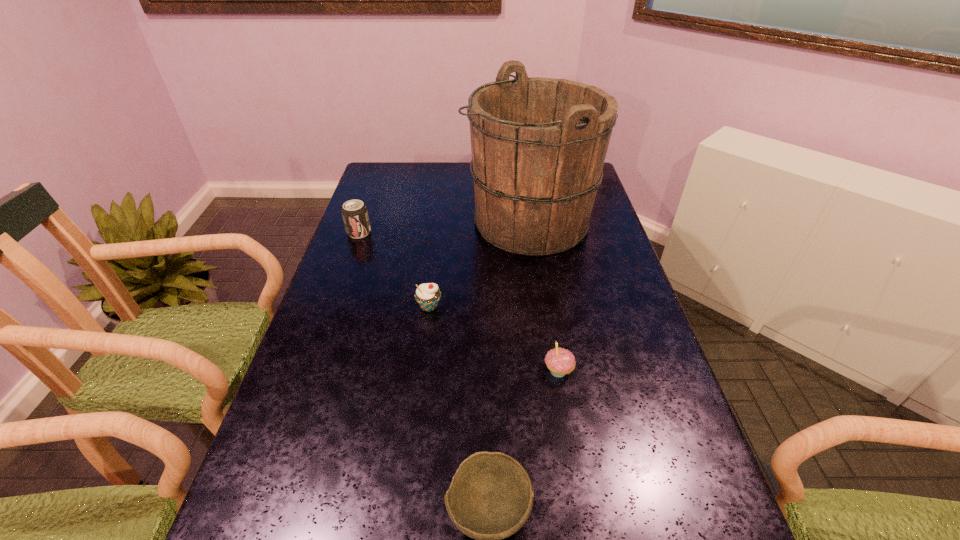
This screenshot has width=960, height=540. Identify the location of free spot between the soda can and the left cupcake. (394, 269).

At what (x,y) coordinates should I click in order to perform the action: click on vacant space that is in between the soda can and the bucket. Please return your answer as a coordinate pair (x, y). Looking at the image, I should click on pyautogui.click(x=444, y=227).

Choose which object is the second nearest neighbor to the farther cupcake. Please provide its 2D coordinates. Your answer should be formatted as a tuple, i.e. [(x, y)], where the tuple contains the x and y coordinates of a point satisfying the conditions above.

[(560, 361)]

The image size is (960, 540). I want to click on the closest object relative to the leftmost object, so tap(538, 145).

Where is `free space that satisfies the following two spatial constraints: 1. on the front side of the leftmost object; 2. on the left side of the farther cupcake`? free space that satisfies the following two spatial constraints: 1. on the front side of the leftmost object; 2. on the left side of the farther cupcake is located at coordinates 332,307.

Find the location of a particular element. The image size is (960, 540). free spot that satisfies the following two spatial constraints: 1. on the front side of the soda can; 2. on the right side of the fourth object from right to left is located at coordinates (332, 307).

Where is `vacant region that satisfies the following two spatial constraints: 1. on the front side of the tallest object; 2. on the right side of the nearer cupcake`? This screenshot has height=540, width=960. vacant region that satisfies the following two spatial constraints: 1. on the front side of the tallest object; 2. on the right side of the nearer cupcake is located at coordinates point(550,371).

Locate an element on the screen. This screenshot has width=960, height=540. vacant space that satisfies the following two spatial constraints: 1. on the front side of the right cupcake; 2. on the left side of the tallest object is located at coordinates (550, 371).

At what (x,y) coordinates should I click in order to perform the action: click on vacant region that satisfies the following two spatial constraints: 1. on the front side of the bucket; 2. on the right side of the right cupcake. Please return your answer as a coordinate pair (x, y). Looking at the image, I should click on (550, 371).